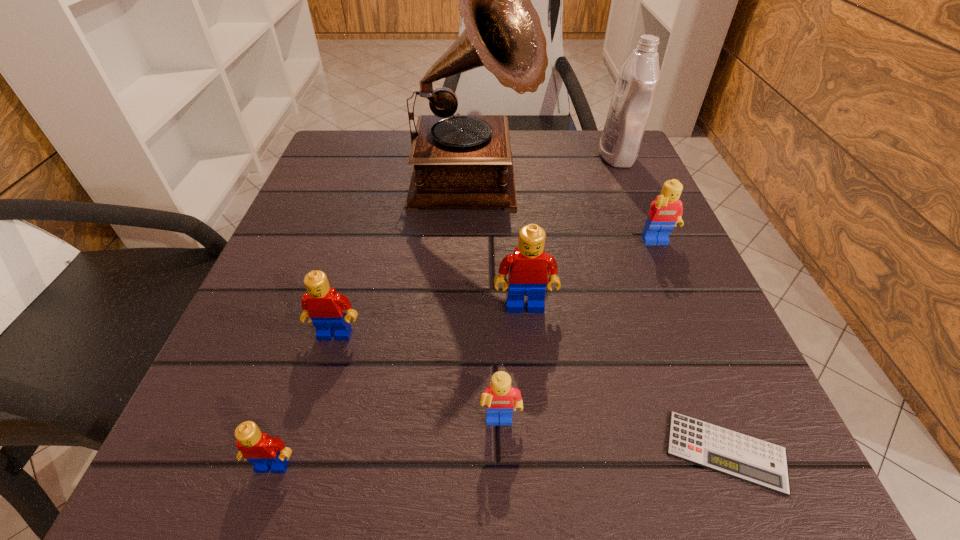
Find the location of a particular element. Image resolution: width=960 pixels, height=540 pixels. vacant space in between the second farthest red Lego and the fourth farthest Lego is located at coordinates (418, 379).

Where is `free spot between the sixth nearest object and the rightmost red Lego`? This screenshot has width=960, height=540. free spot between the sixth nearest object and the rightmost red Lego is located at coordinates (591, 275).

You are a GUI agent. You are given a task and a screenshot of the screen. Output one action in this format:
    pyautogui.click(x=<x>, y=<y>)
    Task: Click on the free spot between the tallest object and the calculator
    
    Given the screenshot: What is the action you would take?
    pyautogui.click(x=599, y=319)

The image size is (960, 540). I want to click on vacant space in between the tallest object and the shortest object, so click(x=599, y=319).

Identify the location of the third closest object to the shortest object. This screenshot has height=540, width=960. (665, 212).

Locate which object ranks third in proximity to the detergent. Please provide its 2D coordinates. Your answer should be formatted as a tuple, i.e. [(x, y)], where the tuple contains the x and y coordinates of a point satisfying the conditions above.

[(527, 267)]

Identify the location of Lego that can be found as the fifth closest to the white detergent. [266, 454].

Point out which Lego is positioned as the nearest to the sixth nearest object. Please provide its 2D coordinates. Your answer should be formatted as a tuple, i.e. [(x, y)], where the tuple contains the x and y coordinates of a point satisfying the conditions above.

[(527, 267)]

Select which red Lego appears as the second closest to the tallest object. Please provide its 2D coordinates. Your answer should be formatted as a tuple, i.e. [(x, y)], where the tuple contains the x and y coordinates of a point satisfying the conditions above.

[(323, 306)]

Locate an element on the screen. Image resolution: width=960 pixels, height=540 pixels. the closest red Lego to the shortest object is located at coordinates (527, 267).